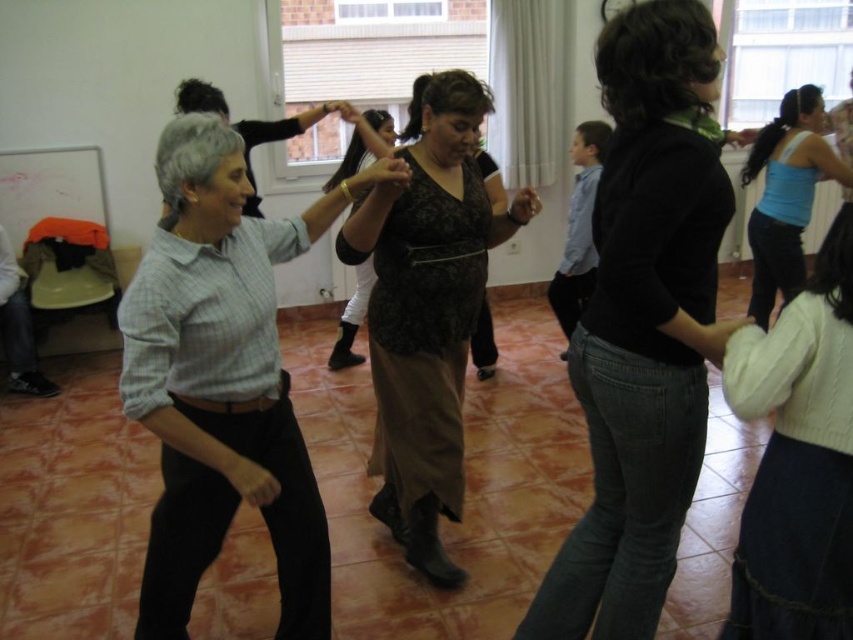
You are a photographer setting up a camera at the back of the dance studio. You want to ensure both the light blue plaid shirt at center and the matte black dress at center are fully visible in your shot. Given their heights, which clothing item might require you to adjust your camera angle to avoid being blocked?

The light blue plaid shirt at center is taller than the matte black dress at center. To ensure both are fully visible, you might need to angle the camera slightly upward to account for the height difference, preventing the light blue plaid shirt at center from blocking the matte black dress at center.

You are standing at the entrance of the dance studio and see two points marked on the floor where dancers are positioned. The first point is at coordinates point (612,524) and the second is at point (398,326). According to the image, which point is closer to you?

Point (612,524) is in front of point (398,326), so it is closer to you.